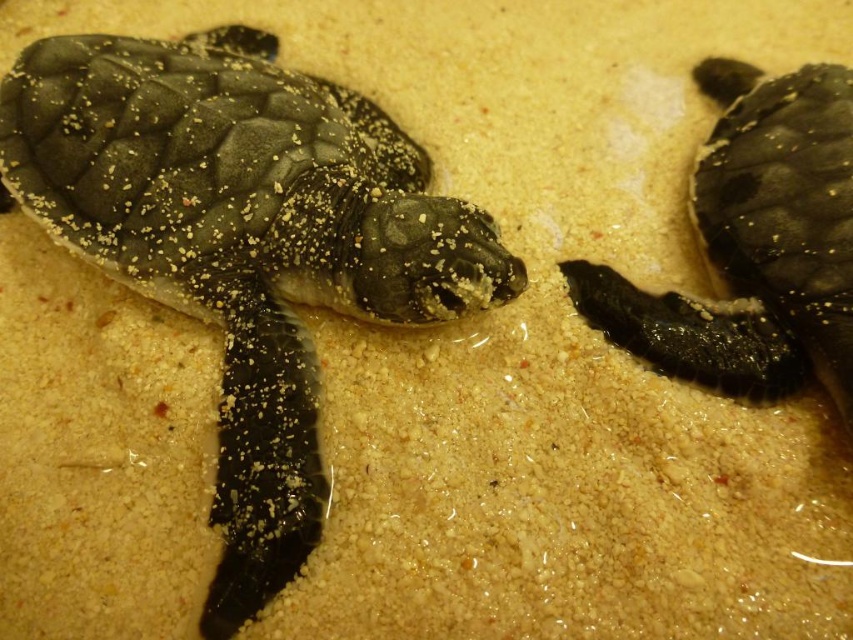
Question: Is shiny black turtle at center bigger than black matte turtle at upper right?

Choices:
 (A) no
 (B) yes

Answer: (B)

Question: Which of the following is the closest to the observer?

Choices:
 (A) (76, 104)
 (B) (732, 368)

Answer: (B)

Question: Among these objects, which one is farthest from the camera?

Choices:
 (A) shiny black turtle at center
 (B) black matte turtle at upper right

Answer: (B)

Question: Can you confirm if shiny black turtle at center is positioned to the left of black matte turtle at upper right?

Choices:
 (A) yes
 (B) no

Answer: (A)

Question: Is shiny black turtle at center below black matte turtle at upper right?

Choices:
 (A) no
 (B) yes

Answer: (B)

Question: Which object is farther from the camera taking this photo?

Choices:
 (A) black matte turtle at upper right
 (B) shiny black turtle at center

Answer: (A)